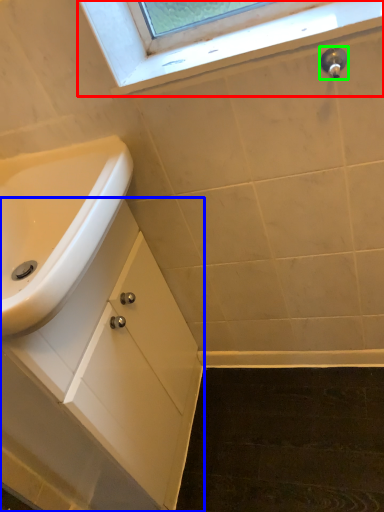
Question: Based on their relative distances, which object is nearer to window (highlighted by a red box)? Choose from bathroom cabinet (highlighted by a blue box) and plumbing fixture (highlighted by a green box).

Choices:
 (A) bathroom cabinet
 (B) plumbing fixture

Answer: (B)